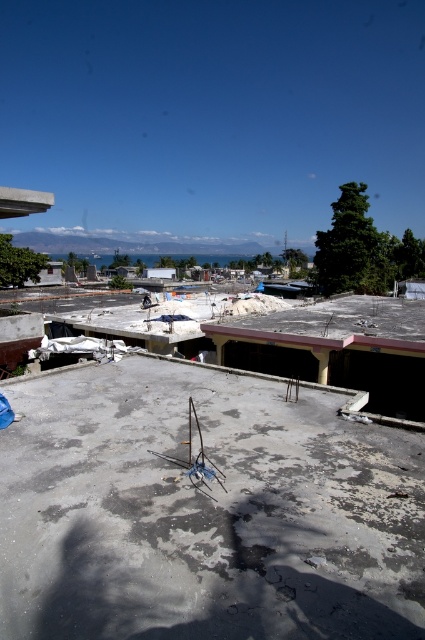
Question: Is gray concrete construction site at center smaller than concrete roof at center?

Choices:
 (A) no
 (B) yes

Answer: (B)

Question: Is gray concrete construction site at center below concrete roof at center?

Choices:
 (A) no
 (B) yes

Answer: (B)

Question: Which of the following is the farthest from the observer?

Choices:
 (A) (28, 492)
 (B) (292, 340)

Answer: (B)

Question: Where is gray concrete construction site at center located in relation to concrete roof at center in the image?

Choices:
 (A) right
 (B) left

Answer: (B)

Question: Which object appears farthest from the camera in this image?

Choices:
 (A) gray concrete construction site at center
 (B) concrete roof at center

Answer: (B)